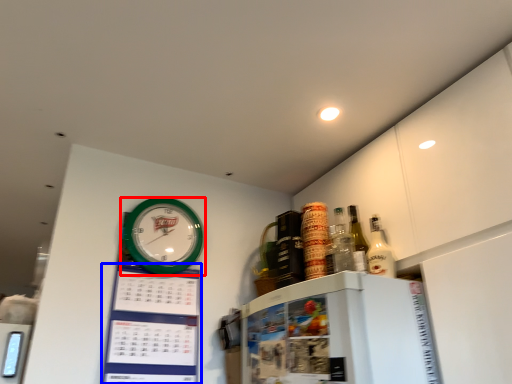
Question: Which of the following is the closest to the observer, wall clock (highlighted by a red box) or bulletin board (highlighted by a blue box)?

Choices:
 (A) wall clock
 (B) bulletin board

Answer: (B)